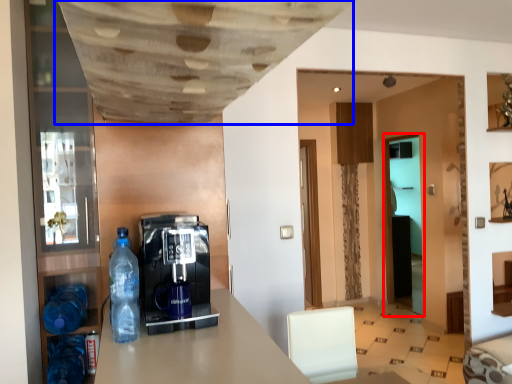
Question: Which of the following is the closest to the observer, glass door (highlighted by a red box) or exhaust hood (highlighted by a blue box)?

Choices:
 (A) glass door
 (B) exhaust hood

Answer: (B)